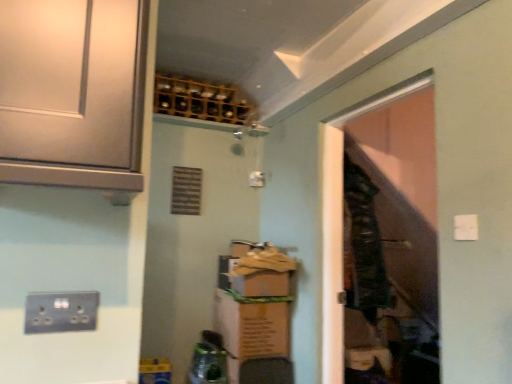
Question: Is dark green fabric laundry at center to the left or to the right of satin white door at upper left in the image?

Choices:
 (A) right
 (B) left

Answer: (A)

Question: Is point (348, 241) closer or farther from the camera than point (57, 28)?

Choices:
 (A) farther
 (B) closer

Answer: (A)

Question: Estimate the real-world distances between objects in this image. Which object is closer to the wooden wine rack at upper center?

Choices:
 (A) transparent plastic door at right
 (B) dark green fabric laundry at center
 (C) white plastic light switch at upper right
 (D) satin white door at upper left
 (E) metallic socket at lower left

Answer: (A)

Question: Considering the real-world distances, which object is farthest from the satin white door at upper left?

Choices:
 (A) wooden wine rack at upper center
 (B) brown cardboard box at center
 (C) transparent plastic door at right
 (D) dark green fabric laundry at center
 (E) metallic socket at lower left

Answer: (A)